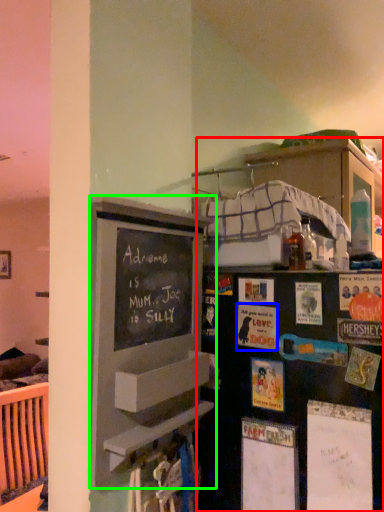
Question: Which is farther away from bookshelf (highlighted by a red box)? postcard (highlighted by a blue box) or bulletin board (highlighted by a green box)?

Choices:
 (A) postcard
 (B) bulletin board

Answer: (A)